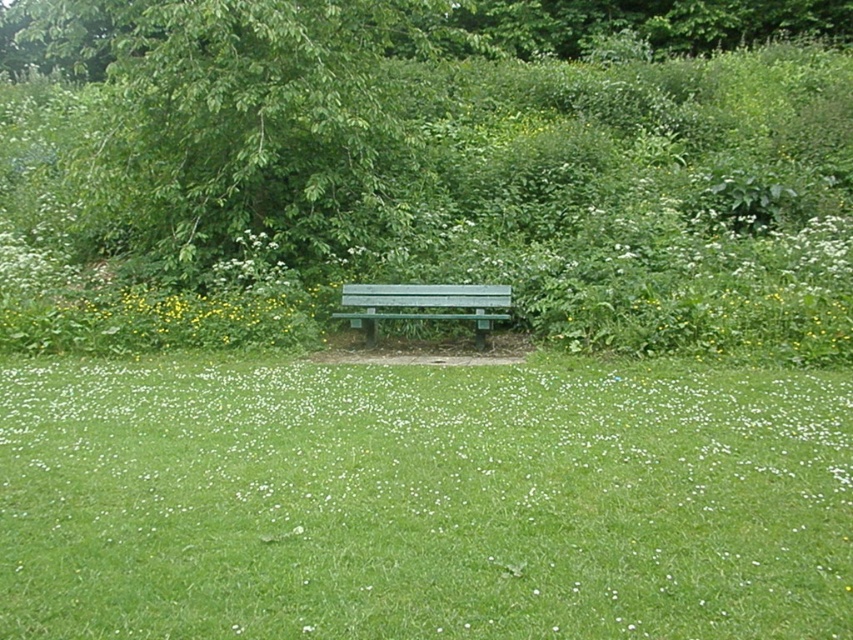
Question: Is green grass at center to the right of green leafy tree at upper left from the viewer's perspective?

Choices:
 (A) yes
 (B) no

Answer: (A)

Question: Among these objects, which one is farthest from the camera?

Choices:
 (A) green painted wood bench at center
 (B) green grass at center

Answer: (A)

Question: Does green grass at center have a lesser width compared to green painted wood bench at center?

Choices:
 (A) yes
 (B) no

Answer: (A)

Question: Which point is farther from the camera taking this photo?

Choices:
 (A) (451, 310)
 (B) (219, 250)

Answer: (B)

Question: Estimate the real-world distances between objects in this image. Which object is farther from the green leafy tree at upper left?

Choices:
 (A) green grass at center
 (B) green painted wood bench at center

Answer: (A)

Question: Does green grass at center appear on the right side of green leafy tree at upper left?

Choices:
 (A) yes
 (B) no

Answer: (A)